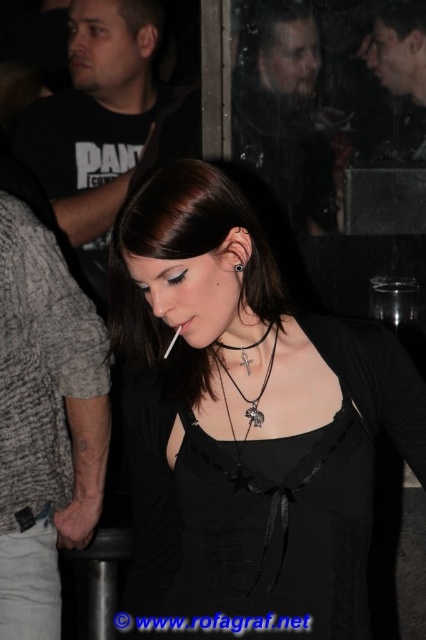
What is located at the coordinates point (x=247, y=417)?

The point (x=247, y=417) is occupied by the matte black dress at center.

The woman in the image is wearing a matte black dress at center and a black leather necklace with cross pendant at center. Which item is positioned higher on her body?

The black leather necklace with cross pendant at center is positioned higher on her body than the matte black dress at center because the dress is located below the necklace.

You are at a social gathering and want to move from point A to point B. The coordinates of point A are point (218, 358) and point B are point (181, 330). Which point is closer to you?

Point (218, 358) is further to the viewer than point (181, 330), so point B is closer to you.